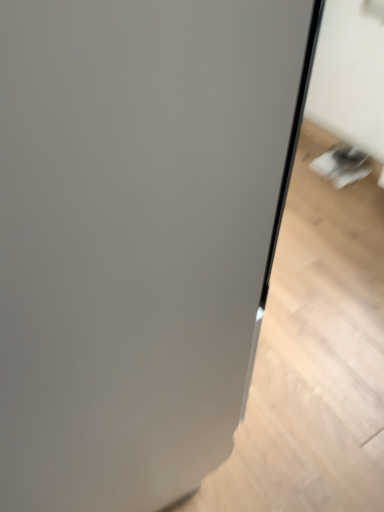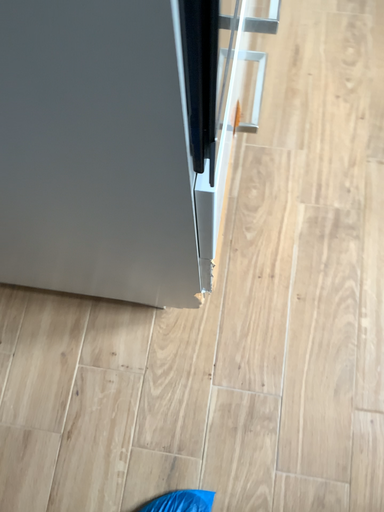
Question: Which way did the camera rotate in the video?

Choices:
 (A) rotated upward
 (B) rotated downward

Answer: (B)